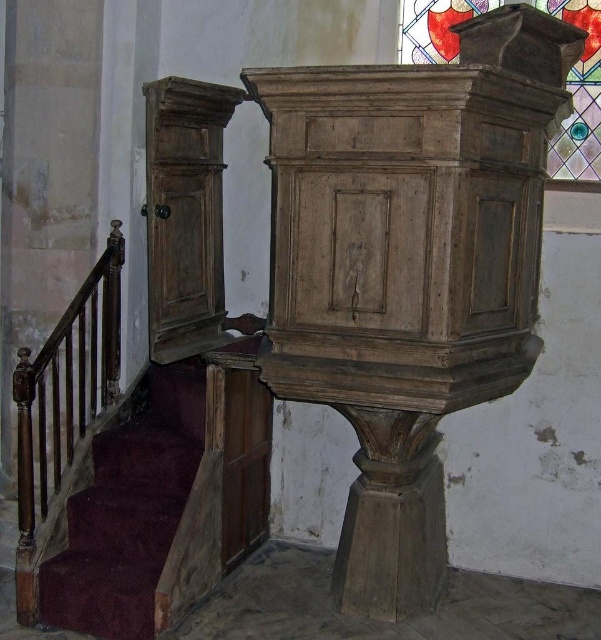
Between point (147, 577) and point (432, 45), which one is positioned behind?

Positioned behind is point (432, 45).

This screenshot has height=640, width=601. I want to click on velvet burgundy stairs at lower left, so click(129, 512).